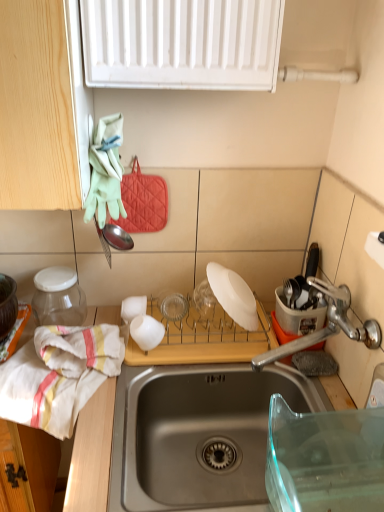
How much space does transparent glass jar at left, the 1th appliance when ordered from left to right, occupy vertically?

The height of transparent glass jar at left, the 1th appliance when ordered from left to right, is 6.83 inches.

Find the location of `white matte plate at center, the second appliance from the left`. white matte plate at center, the second appliance from the left is located at coordinates (205, 342).

You are a GUI agent. You are given a task and a screenshot of the screen. Output one action in this format:
    pyautogui.click(x=<x>, y=<y>)
    Task: Click on the white cotton towel at left
    This screenshot has height=512, width=384.
    Given the screenshot: What is the action you would take?
    pyautogui.click(x=58, y=375)

Describe the element at coordinates (197, 432) in the screenshot. The image size is (384, 512). I see `wooden cutting board at lower center` at that location.

The image size is (384, 512). What do you see at coordinates (202, 433) in the screenshot?
I see `stainless steel sink at center` at bounding box center [202, 433].

You are a GUI agent. You are given a task and a screenshot of the screen. Output one action in this format:
    pyautogui.click(x=<x>, y=<y>)
    Task: Click on the white matte cup at center
    This screenshot has width=384, height=512.
    Given the screenshot: What is the action you would take?
    pyautogui.click(x=146, y=332)

At what (x,y) coordinates should I click in order to perform the action: click on transparent glass jar at left, acting as the 3th appliance starting from the right. Please return your answer as a coordinate pair (x, y). Looking at the image, I should click on (58, 298).

Measure the distance from wooden cutting board at lower center to white matte plate at center, the second appliance from the left.

wooden cutting board at lower center and white matte plate at center, the second appliance from the left, are 5.84 inches apart.

Between wooden cutting board at lower center and white matte plate at center, which is the second appliance in right-to-left order, which one appears on the right side from the viewer's perspective?

Positioned to the right is wooden cutting board at lower center.

Do you think wooden cutting board at lower center is within white matte plate at center, which is the second appliance in right-to-left order, or outside of it?

wooden cutting board at lower center cannot be found inside white matte plate at center, which is the second appliance in right-to-left order.

Is wooden cutting board at lower center with white matte plate at center, the second appliance from the left?

No, wooden cutting board at lower center is not making contact with white matte plate at center, the second appliance from the left.

What's the angular difference between white matte plate at center, which is the second appliance in right-to-left order, and wooden cutting board at lower center's facing directions?

The facing directions of white matte plate at center, which is the second appliance in right-to-left order, and wooden cutting board at lower center are 89.5 degrees apart.

Is white matte plate at center, the second appliance from the left, positioned behind wooden cutting board at lower center?

That is True.

The height and width of the screenshot is (512, 384). I want to click on countertop below the white matte plate at center, which is the second appliance in right-to-left order (from the image's perspective), so click(x=197, y=432).

Which is further, (212, 362) or (167, 493)?

Positioned behind is point (212, 362).

From the image's perspective, does stainless steel sink at center appear lower than white matte plate at center, the second appliance from the left?

Yes, from the image's perspective, stainless steel sink at center is beneath white matte plate at center, the second appliance from the left.

Considering the relative sizes of stainless steel sink at center and white matte plate at center, the second appliance from the left, in the image provided, is stainless steel sink at center taller than white matte plate at center, the second appliance from the left,?

Yes, stainless steel sink at center is taller than white matte plate at center, the second appliance from the left.

Is stainless steel sink at center spatially inside white matte plate at center, the second appliance from the left, or outside of it?

stainless steel sink at center is spatially situated outside white matte plate at center, the second appliance from the left.

Is stainless steel sink at center beside white matte plate at center, which is the second appliance in right-to-left order?

No, stainless steel sink at center is not with white matte plate at center, which is the second appliance in right-to-left order.

Is wooden cutting board at lower center at the left side of satin nickel faucet at right?

Yes, wooden cutting board at lower center is to the left of satin nickel faucet at right.

Does wooden cutting board at lower center come in front of satin nickel faucet at right?

That is True.

Which of these two, wooden cutting board at lower center or satin nickel faucet at right, stands shorter?

satin nickel faucet at right is shorter.

Considering the sizes of white cotton towel at left and white matte plate at center, which is the 3th appliance from left to right, in the image, is white cotton towel at left wider or thinner than white matte plate at center, which is the 3th appliance from left to right,?

white cotton towel at left is wider than white matte plate at center, which is the 3th appliance from left to right.

From the white cotton towel at left, count 2nd appliance to the right and point to it. Please provide its 2D coordinates.

[(233, 295)]

Between white cotton towel at left and white matte plate at center, which is the 3th appliance from left to right, which one appears on the left side from the viewer's perspective?

white cotton towel at left is more to the left.

Is white cotton towel at left oriented away from white matte plate at center, which is the second appliance in right-to-left order?

Yes.

How many degrees apart are the facing directions of white cotton towel at left and white matte plate at center, which is the second appliance in right-to-left order?

The facing directions of white cotton towel at left and white matte plate at center, which is the second appliance in right-to-left order, are 28.8 degrees apart.

From the image's perspective, does white cotton towel at left appear higher than white matte plate at center, which is the second appliance in right-to-left order?

No.

Is white cotton towel at left to the left or to the right of white matte plate at center, the second appliance from the left, in the image?

In the image, white cotton towel at left appears on the left side of white matte plate at center, the second appliance from the left.

Is white matte cup at center inside or outside of transparent glass jar at left, acting as the 3th appliance starting from the right?

white matte cup at center exists outside the volume of transparent glass jar at left, acting as the 3th appliance starting from the right.

Could you tell me if white matte cup at center is facing transparent glass jar at left, the 1th appliance when ordered from left to right?

No.

Is white matte cup at center far away from transparent glass jar at left, the 1th appliance when ordered from left to right?

No, white matte cup at center is in close proximity to transparent glass jar at left, the 1th appliance when ordered from left to right.

From a real-world perspective, is white matte cup at center below transparent glass jar at left, acting as the 3th appliance starting from the right?

Correct, in the physical world, white matte cup at center is lower than transparent glass jar at left, acting as the 3th appliance starting from the right.

The image size is (384, 512). I want to click on countertop lying in front of the white matte plate at center, the second appliance from the left, so 197,432.

You are a GUI agent. You are given a task and a screenshot of the screen. Output one action in this format:
    pyautogui.click(x=<x>, y=<y>)
    Task: Click on the countertop that appears on the right of white matte plate at center, which is the second appliance in right-to-left order
    
    Given the screenshot: What is the action you would take?
    pyautogui.click(x=197, y=432)

Estimate the real-world distances between objects in this image. Which object is further from white matte plate at center, the second appliance from the left, transparent glass jar at left, acting as the 3th appliance starting from the right, or stainless steel sink at center?

transparent glass jar at left, acting as the 3th appliance starting from the right, is further to white matte plate at center, the second appliance from the left.

When comparing their distances from white cotton towel at left, does stainless steel sink at center or white matte cup at center seem closer?

Among the two, white matte cup at center is located nearer to white cotton towel at left.

Based on their spatial positions, is stainless steel sink at center or white cotton towel at left closer to satin nickel faucet at right?

The object closer to satin nickel faucet at right is stainless steel sink at center.

Based on their spatial positions, is stainless steel sink at center or white cotton towel at left further from white matte plate at center, arranged as the 1th appliance when viewed from the right?

Among the two, white cotton towel at left is located further to white matte plate at center, arranged as the 1th appliance when viewed from the right.

When comparing their distances from wooden cutting board at lower center, does white matte plate at center, arranged as the 1th appliance when viewed from the right, or white matte plate at center, the second appliance from the left, seem closer?

Based on the image, white matte plate at center, the second appliance from the left, appears to be nearer to wooden cutting board at lower center.

From the picture: Looking at the image, which one is located further to wooden cutting board at lower center, white matte cup at center or white cotton towel at left?

white matte cup at center lies further to wooden cutting board at lower center than the other object.

Considering their positions, is white matte plate at center, arranged as the 1th appliance when viewed from the right, positioned closer to satin nickel faucet at right than transparent glass jar at left, acting as the 3th appliance starting from the right?

Based on the image, white matte plate at center, arranged as the 1th appliance when viewed from the right, appears to be nearer to satin nickel faucet at right.

When comparing their distances from white cotton towel at left, does satin nickel faucet at right or white matte plate at center, the second appliance from the left, seem closer?

Among the two, white matte plate at center, the second appliance from the left, is located nearer to white cotton towel at left.

The height and width of the screenshot is (512, 384). In order to click on appliance situated between transparent glass jar at left, acting as the 3th appliance starting from the right, and stainless steel sink at center from left to right in this screenshot , I will do `click(205, 342)`.

The image size is (384, 512). I want to click on tap between stainless steel sink at center and white matte cup at center from front to back, so click(326, 326).

Find the location of `tableware between white cotton towel at left and white matte plate at center, which is the second appliance in right-to-left order, in the horizontal direction`. tableware between white cotton towel at left and white matte plate at center, which is the second appliance in right-to-left order, in the horizontal direction is located at coordinates click(146, 332).

Locate an element on the screen. appliance located between white matte cup at center and white matte plate at center, which is the 3th appliance from left to right, in the left-right direction is located at coordinates (205, 342).